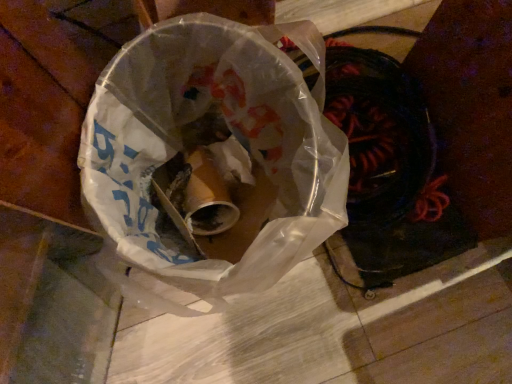
The image size is (512, 384). Identify the location of transparent plastic bag at center. (213, 154).

Describe the element at coordinates (213, 154) in the screenshot. I see `transparent plastic bag at center` at that location.

In order to face transparent plastic bag at center, should I rotate leftwards or rightwards?

You should look left and rotate roughly 2.517 degrees.

Where is `transparent plastic bag at center`? This screenshot has width=512, height=384. transparent plastic bag at center is located at coordinates (213, 154).